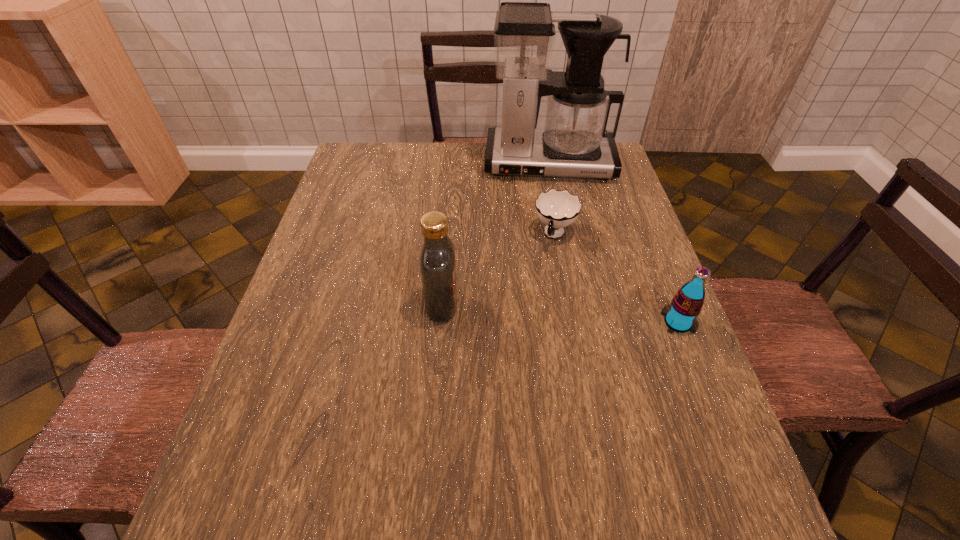
The height and width of the screenshot is (540, 960). What are the coordinates of `blank space located on the side of the cup with the handle` in the screenshot? It's located at pos(539,287).

Image resolution: width=960 pixels, height=540 pixels. In order to click on vacant space situated on the side of the cup with the handle in this screenshot , I will do `click(543, 273)`.

Identify the location of free point located 0.340m at the front of the farthest object where the controls are located. Image resolution: width=960 pixels, height=540 pixels. (554, 262).

I want to click on free space located at the front of the farthest object where the controls are located, so click(x=555, y=276).

I want to click on free location located 0.310m at the front of the farthest object where the controls are located, so click(x=553, y=254).

Identify the location of object present at the far edge. Image resolution: width=960 pixels, height=540 pixels. (574, 142).

Where is `soda that is at the right edge`? The height and width of the screenshot is (540, 960). soda that is at the right edge is located at coordinates click(x=680, y=316).

Identify the location of coffee maker at the right edge. The width and height of the screenshot is (960, 540). (574, 142).

I want to click on object that is at the far right corner, so click(x=574, y=142).

Identify the location of free space at the far edge of the desktop. (421, 142).